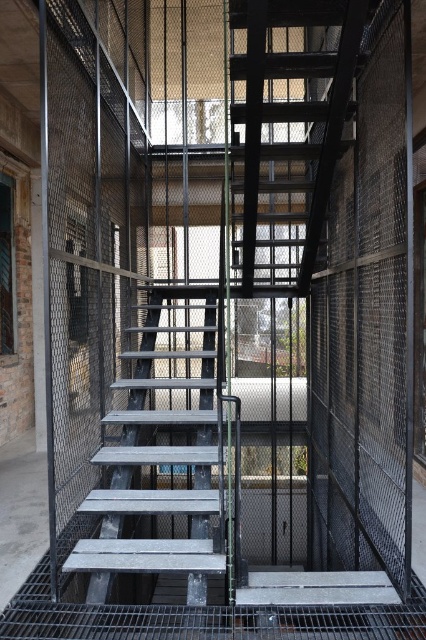
Is matte black staircase at center further to camera compared to metallic gray stairs at center?

No, it is not.

In the scene shown: Between matte black staircase at center and metallic gray stairs at center, which one has more height?

Standing taller between the two is matte black staircase at center.

Which is behind, point (252, 58) or point (86, 548)?

Point (86, 548)

What are the coordinates of `matte black staircase at center` in the screenshot? It's located at (290, 138).